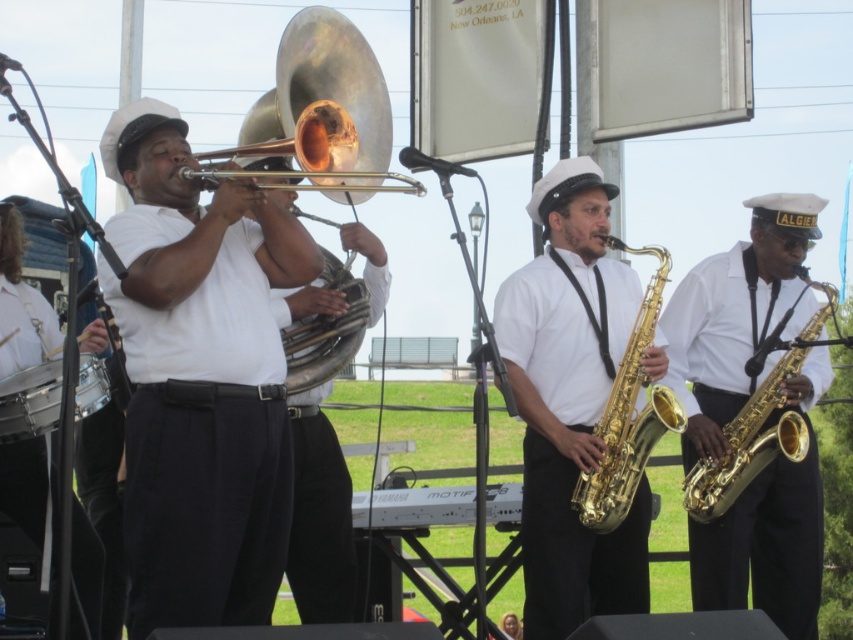
Question: Which point is farther to the camera?

Choices:
 (A) gold shiny trumpet at upper center
 (B) gold shiny saxophone at right
 (C) gold shiny trumpet at center

Answer: (B)

Question: Can you confirm if shiny brass trombone at left is smaller than gold shiny saxophone at center?

Choices:
 (A) no
 (B) yes

Answer: (A)

Question: Which point is closer to the camera taking this photo?

Choices:
 (A) coord(650,296)
 (B) coord(165,138)
 (C) coord(563,396)
 (D) coord(299,140)

Answer: (B)

Question: Among these objects, which one is nearest to the camera?

Choices:
 (A) gold shiny saxophone at right
 (B) gold shiny trumpet at center
 (C) gold shiny saxophone at center

Answer: (B)

Question: Is gold shiny saxophone at right wider than gold shiny trumpet at center?

Choices:
 (A) no
 (B) yes

Answer: (B)

Question: Is gold shiny saxophone at right above black drum at lower left?

Choices:
 (A) no
 (B) yes

Answer: (B)